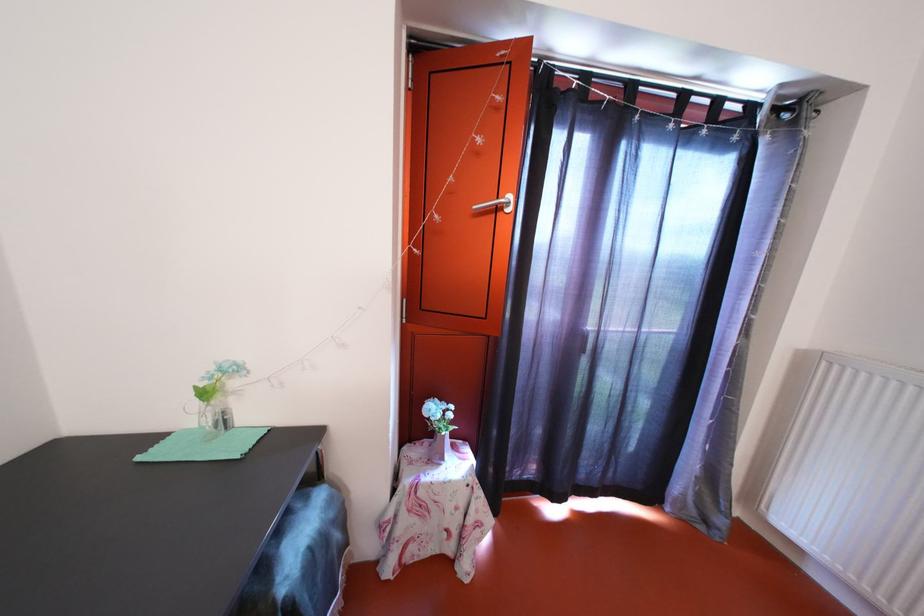
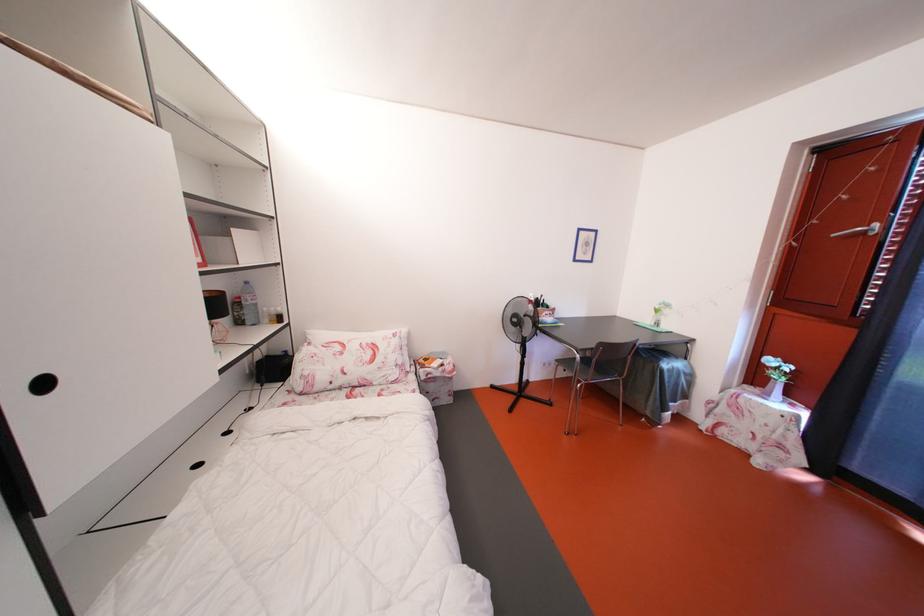
In the second image, find the point that corresponds to point 440,415 in the first image.

(779, 367)